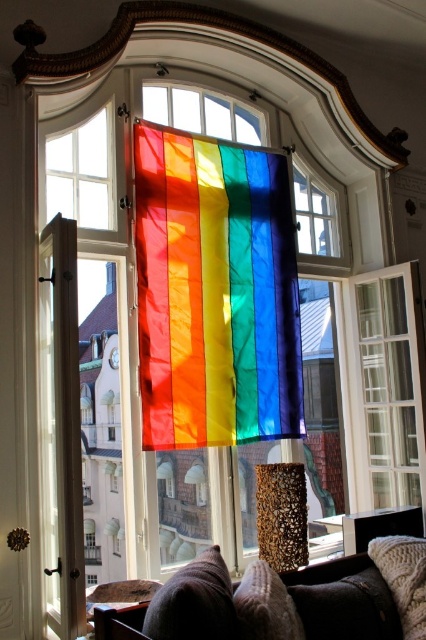
Question: Can you confirm if velvet brown couch at lower center is thinner than transparent glass window at center?

Choices:
 (A) yes
 (B) no

Answer: (B)

Question: Estimate the real-world distances between objects in this image. Which object is farther from the velvet brown couch at lower center?

Choices:
 (A) rainbow fabric flag at center
 (B) transparent glass window at center
 (C) clear glass window at center

Answer: (B)

Question: Which point is closer to the camera?

Choices:
 (A) velvety dark brown pillow at lower center
 (B) rainbow stained glass at center
 (C) brown textured pillow at lower center
 (D) rainbow fabric flag at center

Answer: (C)

Question: From the image, what is the correct spatial relationship of velvet brown couch at lower center in relation to clear glass window at center?

Choices:
 (A) above
 (B) below

Answer: (B)

Question: Does knitted white pillow at lower right appear on the right side of transparent glass window at center?

Choices:
 (A) no
 (B) yes

Answer: (B)

Question: Which of the following is the closest to the observer?

Choices:
 (A) (112, 220)
 (B) (158, 152)

Answer: (A)